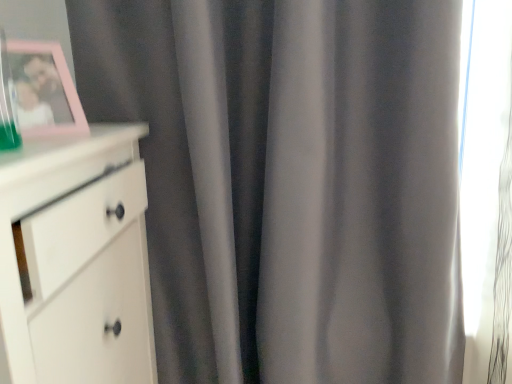
Question: In the image, is pink plastic picture frame at upper left on the left side or the right side of white matte chest of drawers at left?

Choices:
 (A) right
 (B) left

Answer: (A)

Question: Considering the positions of pink plastic picture frame at upper left and white matte chest of drawers at left in the image, is pink plastic picture frame at upper left bigger or smaller than white matte chest of drawers at left?

Choices:
 (A) big
 (B) small

Answer: (B)

Question: Is point (37, 59) closer or farther from the camera than point (122, 198)?

Choices:
 (A) farther
 (B) closer

Answer: (B)

Question: Visually, is white matte chest of drawers at left positioned to the left or to the right of pink plastic picture frame at upper left?

Choices:
 (A) left
 (B) right

Answer: (A)

Question: Considering the positions of white matte chest of drawers at left and pink plastic picture frame at upper left in the image, is white matte chest of drawers at left taller or shorter than pink plastic picture frame at upper left?

Choices:
 (A) short
 (B) tall

Answer: (B)

Question: Is white matte chest of drawers at left bigger or smaller than pink plastic picture frame at upper left?

Choices:
 (A) small
 (B) big

Answer: (B)

Question: From the image's perspective, is white matte chest of drawers at left positioned above or below pink plastic picture frame at upper left?

Choices:
 (A) above
 (B) below

Answer: (B)